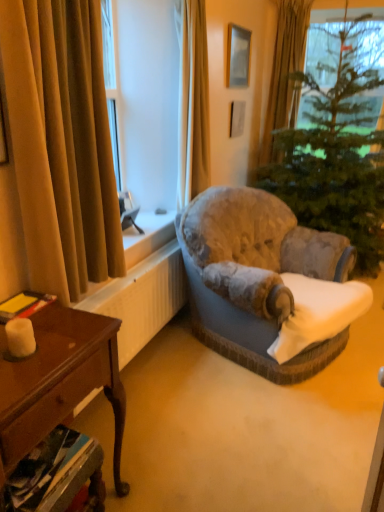
The height and width of the screenshot is (512, 384). In order to click on vacant space underneath white textured radiator at lower left (from a real-world perspective) in this screenshot , I will do `click(141, 362)`.